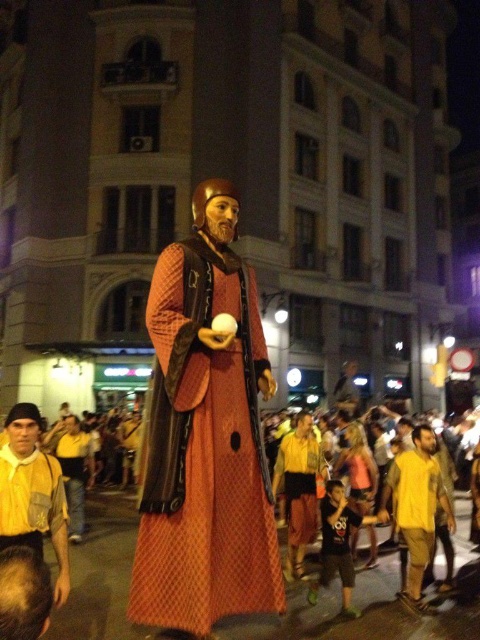
Question: Which object appears farthest from the camera in this image?

Choices:
 (A) orange fabric figure at center
 (B) yellow cotton shirt at center

Answer: (B)

Question: Can you confirm if orange fabric figure at center is thinner than yellow cotton shirt at center?

Choices:
 (A) yes
 (B) no

Answer: (B)

Question: Which point is farther to the camera?

Choices:
 (A) (58, 582)
 (B) (235, 348)
 (C) (404, 509)

Answer: (C)

Question: Observing the image, what is the correct spatial positioning of orange fabric figure at center in reference to yellow cotton shirt at center?

Choices:
 (A) below
 (B) above

Answer: (B)

Question: Based on their relative distances, which object is farther from the orange fabric figure at center?

Choices:
 (A) yellow fabric shirt at lower left
 (B) yellow cotton shirt at center

Answer: (B)

Question: Is yellow fabric shirt at lower left above yellow cotton shirt at center?

Choices:
 (A) yes
 (B) no

Answer: (A)